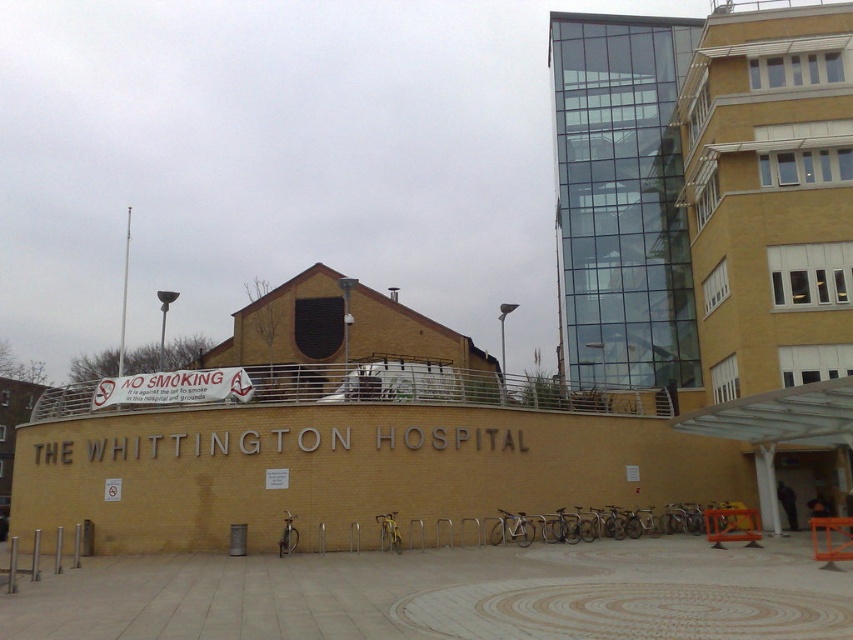
You are a visitor arriving at The Whittington Hospital and see two bicycles in front of the main building. Which bicycle is closer to you, the silver metallic bicycle at center or the gold metallic bicycle at lower center?

The silver metallic bicycle at center is closer to you because it is further to the viewer than the gold metallic bicycle at lower center.